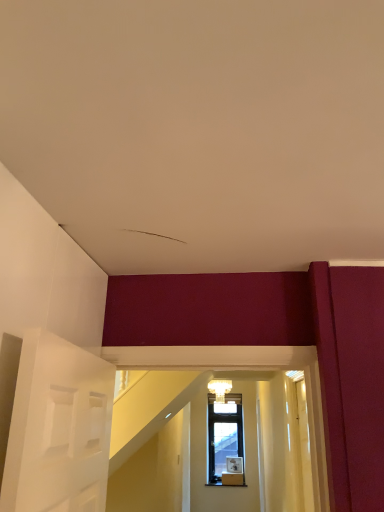
What do you see at coordinates (220, 389) in the screenshot? I see `translucent glass chandelier at center` at bounding box center [220, 389].

Identify the location of translucent glass chandelier at center. (220, 389).

In order to face translucent glass chandelier at center, should I rotate leftwards or rightwards?

You should rotate right by 3.863 degrees.

This screenshot has width=384, height=512. I want to click on translucent glass chandelier at center, so click(x=220, y=389).